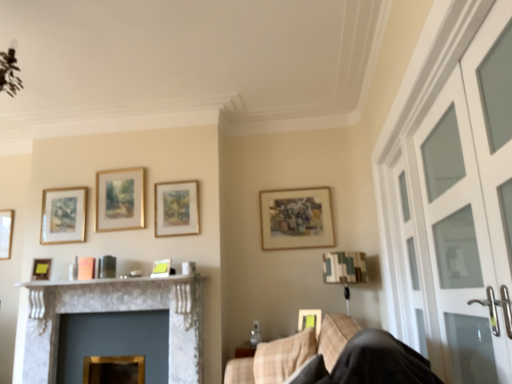
At what (x,y) coordinates should I click in order to perform the action: click on free space above matte gold picture frame at upper center, which appears as the second picture frame when viewed from the right (from a real-world perspective). Please return your answer as a coordinate pair (x, y). This screenshot has width=512, height=384. Looking at the image, I should click on (297, 180).